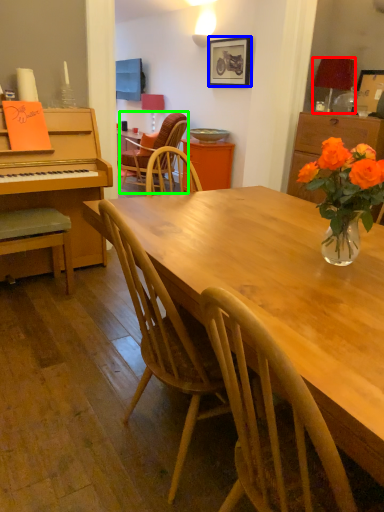
Question: Which object is the closest to the lamp (highlighted by a red box)? Choose among these: picture frame (highlighted by a blue box) or chair (highlighted by a green box).

Choices:
 (A) picture frame
 (B) chair

Answer: (A)